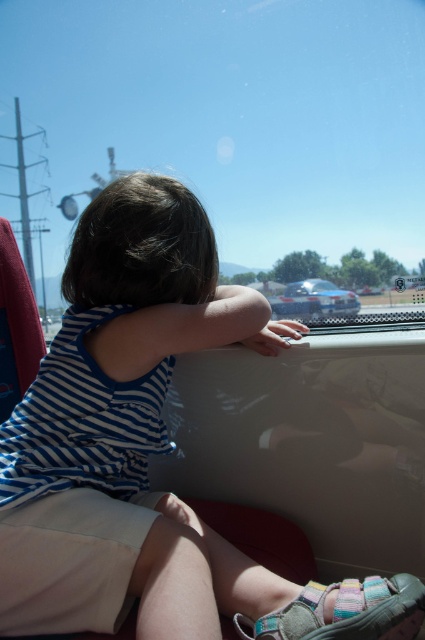
Question: Does blue striped tank top at center come in front of glossy metallic car at center?

Choices:
 (A) yes
 (B) no

Answer: (A)

Question: Where is blue striped tank top at center located in relation to glossy metallic car at center in the image?

Choices:
 (A) right
 (B) left

Answer: (B)

Question: Can you confirm if multicolored fabric sandal at lower center is positioned below glossy metallic car at center?

Choices:
 (A) yes
 (B) no

Answer: (A)

Question: Estimate the real-world distances between objects in this image. Which object is farther from the glossy metallic car at center?

Choices:
 (A) multicolored fabric sandal at lower center
 (B) blue striped tank top at center

Answer: (A)

Question: Which point appears closest to the camera in this image?

Choices:
 (A) (108, 428)
 (B) (311, 289)

Answer: (A)

Question: Which point is closer to the camera?

Choices:
 (A) (292, 291)
 (B) (422, 605)
 (C) (76, 388)

Answer: (B)